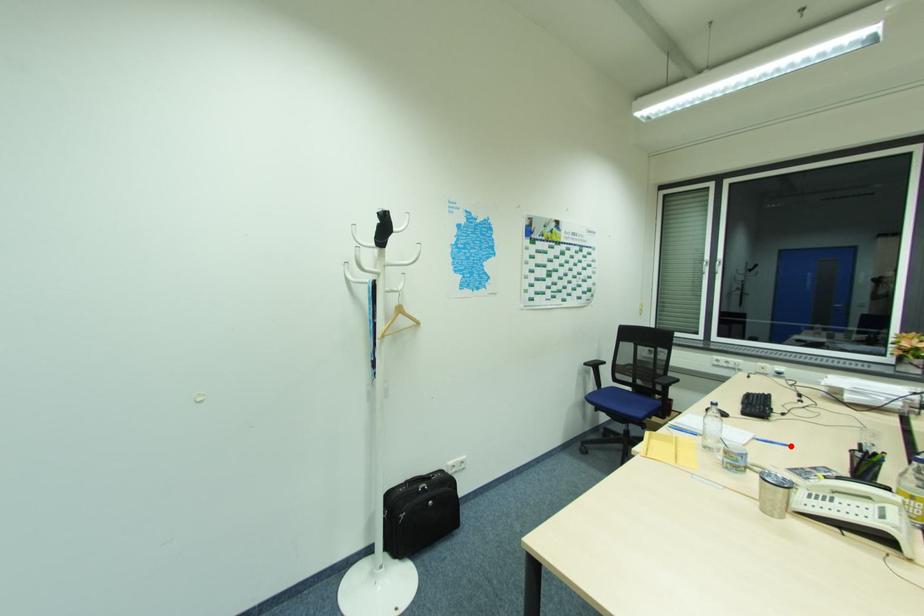
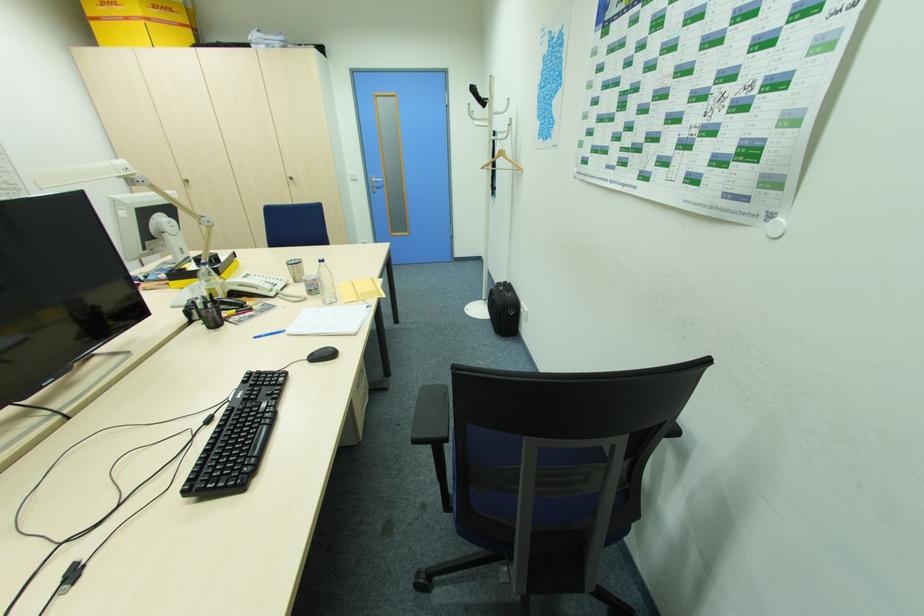
Find the pixel in the second image that matches the highlighted location in the first image.

(258, 338)